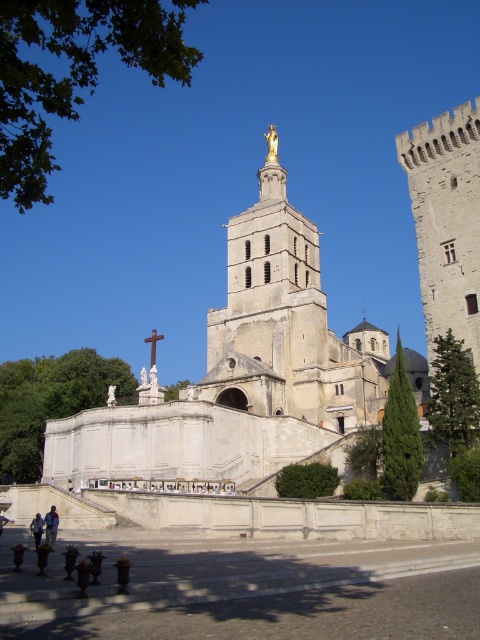
You are standing in front of the historic church and see a person wearing a light blue fabric jacket at lower left and dark brown leather shoes at lower left. Which item is wider?

The light blue fabric jacket at lower left is less wide than the dark brown leather shoes at lower left, so the dark brown leather shoes at lower left are wider.

You are standing in front of the historic church and want to take a photo that includes both the golden statue at the top of the bell tower and the large cross near the entrance. The golden statue corresponds to point (37, 531) and the large cross corresponds to point (152, 344). Which object should you focus on first to ensure both are in focus?

You should focus on the golden statue at the top of the bell tower corresponding to point (37, 531) first because it is closer to the camera than the large cross at point (152, 344). This way, adjusting the focus from near to far will help both objects be in focus.

You are standing in front of the historic church and notice two items of interest. You see the dark blue jeans at lower left and the white wooden cross at upper center. Which item is positioned higher up in the image?

The white wooden cross at upper center is positioned higher up in the image than the dark blue jeans at lower left.